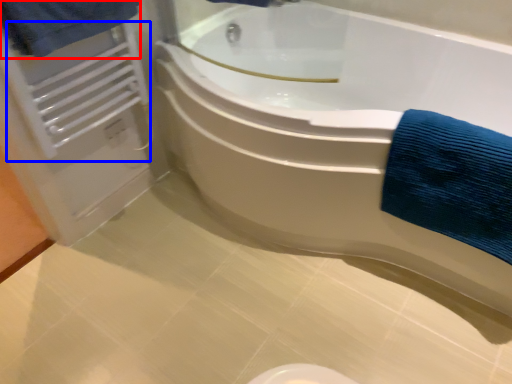
Question: Among these objects, which one is farthest to the camera, bath towel (highlighted by a red box) or radiator (highlighted by a blue box)?

Choices:
 (A) bath towel
 (B) radiator

Answer: (B)